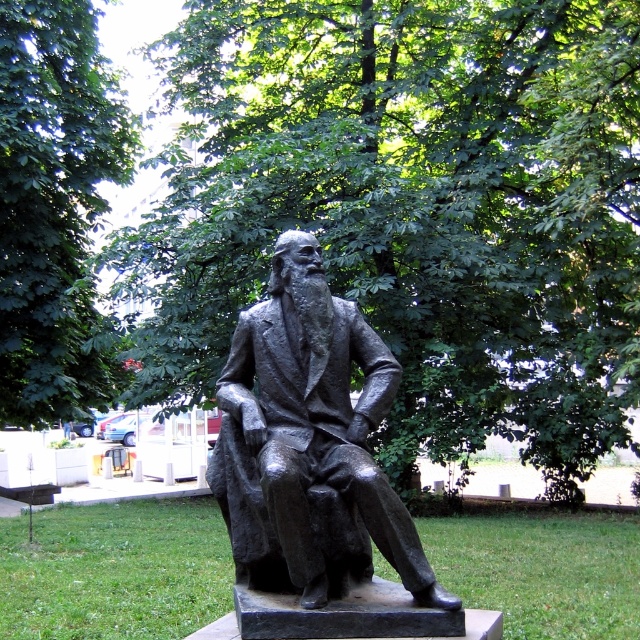
Question: Which point is farther from the camera taking this photo?

Choices:
 (A) (45, 184)
 (B) (180, 269)
 (C) (296, 352)

Answer: (A)

Question: Which is nearer to the green leafy tree at upper center?

Choices:
 (A) bronze statue at center
 (B) green leafy tree at center

Answer: (B)

Question: Which of the following is the closest to the observer?

Choices:
 (A) pos(93,154)
 (B) pos(372,58)
 (C) pos(339,314)

Answer: (C)

Question: Does green leafy tree at center lie in front of bronze statue at center?

Choices:
 (A) yes
 (B) no

Answer: (B)

Question: Does green leafy tree at center appear under bronze statue at center?

Choices:
 (A) yes
 (B) no

Answer: (B)

Question: Can you confirm if bronze statue at center is positioned to the right of green leafy tree at upper center?

Choices:
 (A) no
 (B) yes

Answer: (B)